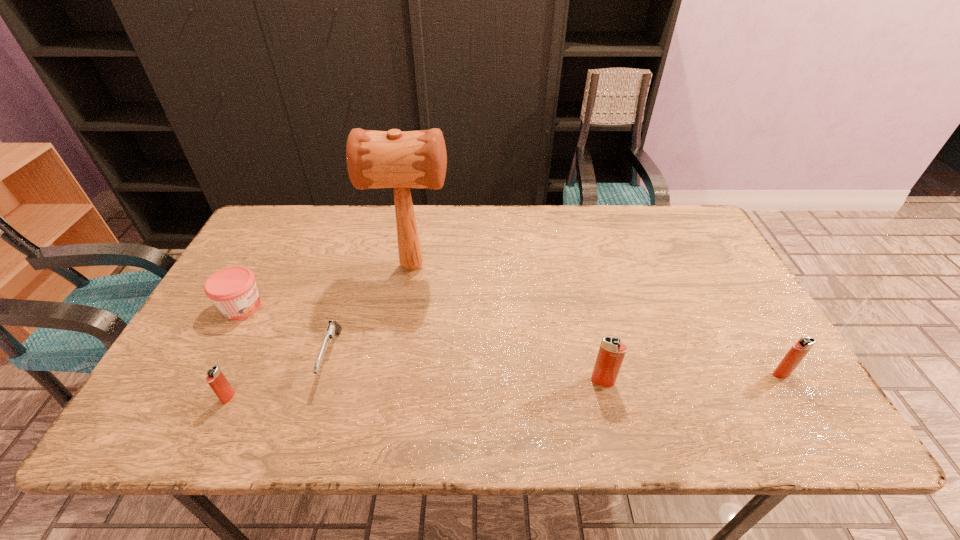
If the aim is uniform spacing by inserting an additional igniter among them, please point to a vacant space for this new igniter. Please provide its 2D coordinates. Your answer should be formatted as a tuple, i.e. [(x, y)], where the tuple contains the x and y coordinates of a point satisfying the conditions above.

[(419, 389)]